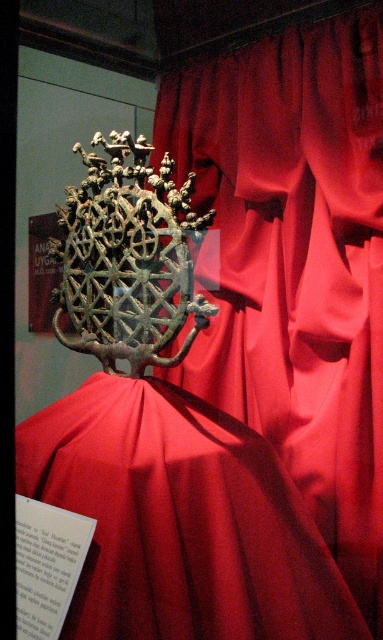
Question: Is satin red curtain at center to the right of satin red dress at center from the viewer's perspective?

Choices:
 (A) yes
 (B) no

Answer: (A)

Question: Which object appears farthest from the camera in this image?

Choices:
 (A) satin red curtain at center
 (B) satin red dress at center

Answer: (A)

Question: Does satin red curtain at center appear under satin red dress at center?

Choices:
 (A) yes
 (B) no

Answer: (B)

Question: Is satin red curtain at center thinner than satin red dress at center?

Choices:
 (A) no
 (B) yes

Answer: (B)

Question: Which point is farther from the camera taking this photo?

Choices:
 (A) (340, 333)
 (B) (104, 392)

Answer: (A)

Question: Which point is farther to the camera?

Choices:
 (A) (335, 102)
 (B) (237, 500)

Answer: (A)